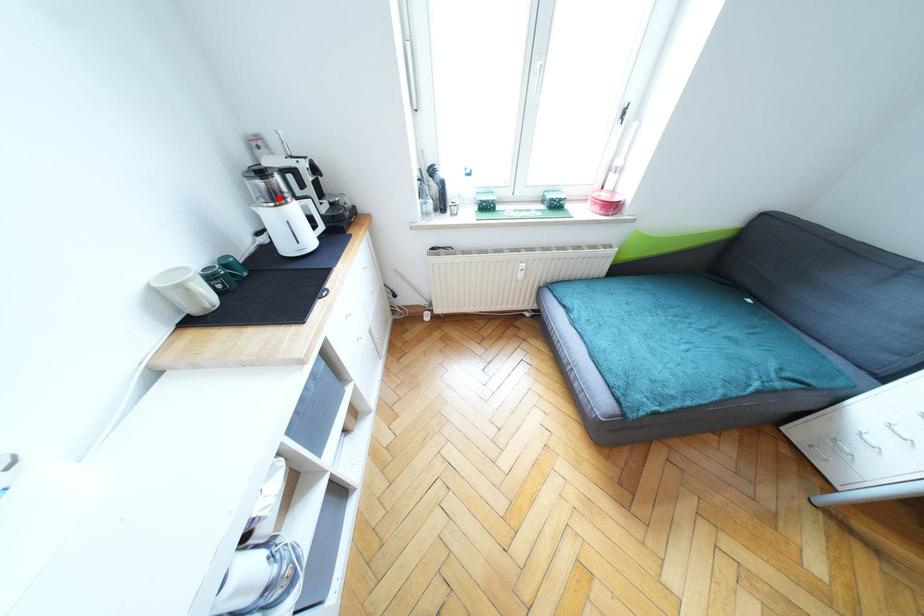
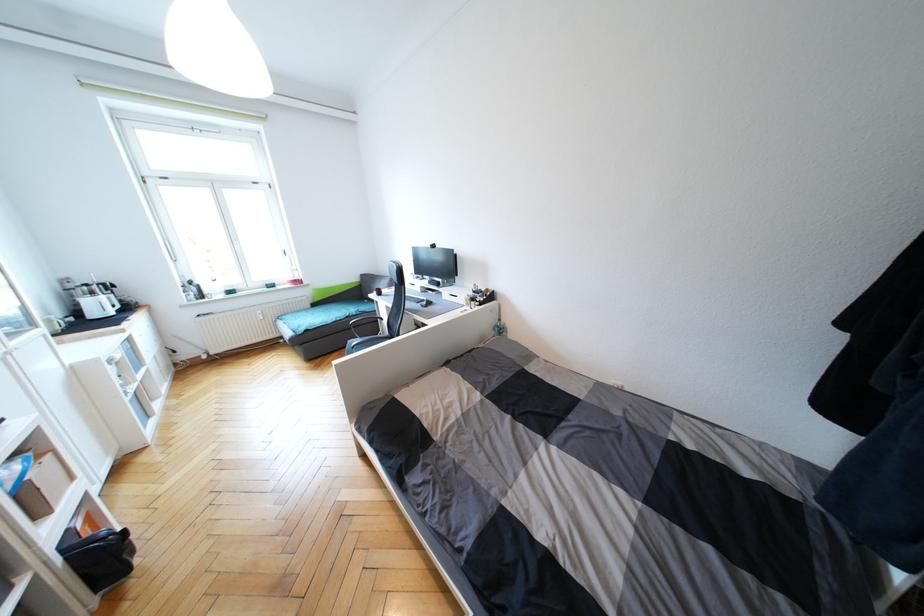
Where in the second image is the point corresponding to the highlighted location from the first image?

(95, 294)